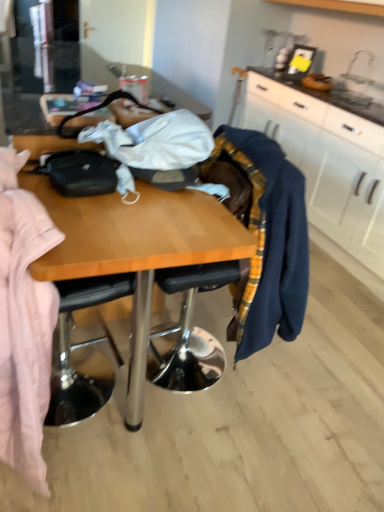
I want to click on white matte cabinet at upper right, so click(329, 170).

Is white matte cabinet at upper right not within metallic silver chair at center?

Yes, white matte cabinet at upper right is outside of metallic silver chair at center.

Can you see white matte cabinet at upper right touching metallic silver chair at center?

No, white matte cabinet at upper right is not next to metallic silver chair at center.

Image resolution: width=384 pixels, height=512 pixels. In order to click on chair that appears below the white matte cabinet at upper right (from a real-world perspective) in this screenshot , I will do `click(211, 285)`.

Is white matte cabinet at upper right facing towards metallic silver chair at center?

Yes, white matte cabinet at upper right is facing metallic silver chair at center.

Between metallic silver chair at center and navy blue sweater at right, which one has larger width?

metallic silver chair at center is wider.

How many degrees apart are the facing directions of metallic silver chair at center and navy blue sweater at right?

The angle between the facing direction of metallic silver chair at center and the facing direction of navy blue sweater at right is 0.572 degrees.

Is metallic silver chair at center not inside navy blue sweater at right?

Absolutely, metallic silver chair at center is external to navy blue sweater at right.

Is point (198, 282) behind point (266, 248)?

Yes, it is.

Looking at this image, considering the positions of objects white matte cabinet at upper right and navy blue sweater at right in the image provided, who is more to the left, white matte cabinet at upper right or navy blue sweater at right?

Positioned to the left is navy blue sweater at right.

Where is `cabinetry on the right of navy blue sweater at right`? cabinetry on the right of navy blue sweater at right is located at coordinates (329, 170).

In the scene shown: Is white matte cabinet at upper right not close to navy blue sweater at right?

white matte cabinet at upper right is positioned a significant distance from navy blue sweater at right.

Can you tell me how much navy blue sweater at right and metallic silver chair at center differ in facing direction?

navy blue sweater at right and metallic silver chair at center are facing 0.572 degrees away from each other.

Is navy blue sweater at right oriented towards metallic silver chair at center?

Yes, navy blue sweater at right faces towards metallic silver chair at center.

Between point (274, 254) and point (240, 329), which one is positioned behind?

The point (240, 329) is farther from the camera.

Is navy blue sweater at right not close to metallic silver chair at center?

No, navy blue sweater at right is not far away from metallic silver chair at center.

Is point (239, 169) farther from viewer compared to point (345, 266)?

No, (239, 169) is closer to viewer.

From the picture: Is metallic silver chair at center aimed at white matte cabinet at upper right?

No, metallic silver chair at center is not aimed at white matte cabinet at upper right.

Can you tell me how much metallic silver chair at center and white matte cabinet at upper right differ in facing direction?

There is a 0.0706-degree angle between the facing directions of metallic silver chair at center and white matte cabinet at upper right.

From a real-world perspective, which is physically below, metallic silver chair at center or white matte cabinet at upper right?

From a 3D spatial view, metallic silver chair at center is below.

Between point (300, 246) and point (305, 125), which one is positioned behind?

Point (305, 125)

Which object is thinner, navy blue sweater at right or white matte cabinet at upper right?

navy blue sweater at right.

Is navy blue sweater at right turned away from white matte cabinet at upper right?

Yes, navy blue sweater at right is facing away from white matte cabinet at upper right.

Between navy blue sweater at right and white matte cabinet at upper right, which one has larger size?

With larger size is white matte cabinet at upper right.

Find the location of a particular element. The image size is (384, 512). cabinetry located on the right of metallic silver chair at center is located at coordinates (329, 170).

At what (x,y) coordinates should I click in order to perform the action: click on chair below the navy blue sweater at right (from a real-world perspective). Please return your answer as a coordinate pair (x, y). This screenshot has width=384, height=512. Looking at the image, I should click on [x=211, y=285].

Estimate the real-world distances between objects in this image. Which object is closer to navy blue sweater at right, metallic silver chair at center or white matte cabinet at upper right?

metallic silver chair at center.

Looking at the image, which one is located further to white matte cabinet at upper right, metallic silver chair at center or navy blue sweater at right?

Based on the image, navy blue sweater at right appears to be further to white matte cabinet at upper right.

Considering their positions, is navy blue sweater at right positioned closer to white matte cabinet at upper right than metallic silver chair at center?

Among the two, metallic silver chair at center is located nearer to white matte cabinet at upper right.

From the image, which object appears to be nearer to navy blue sweater at right, white matte cabinet at upper right or metallic silver chair at center?

metallic silver chair at center.

Looking at the image, which one is located closer to metallic silver chair at center, navy blue sweater at right or white matte cabinet at upper right?

navy blue sweater at right lies closer to metallic silver chair at center than the other object.

From the image, which object appears to be farther from metallic silver chair at center, white matte cabinet at upper right or navy blue sweater at right?

The object further to metallic silver chair at center is white matte cabinet at upper right.

This screenshot has width=384, height=512. What are the coordinates of `clothing located between metallic silver chair at center and white matte cabinet at upper right in the left-right direction` in the screenshot? It's located at (268, 238).